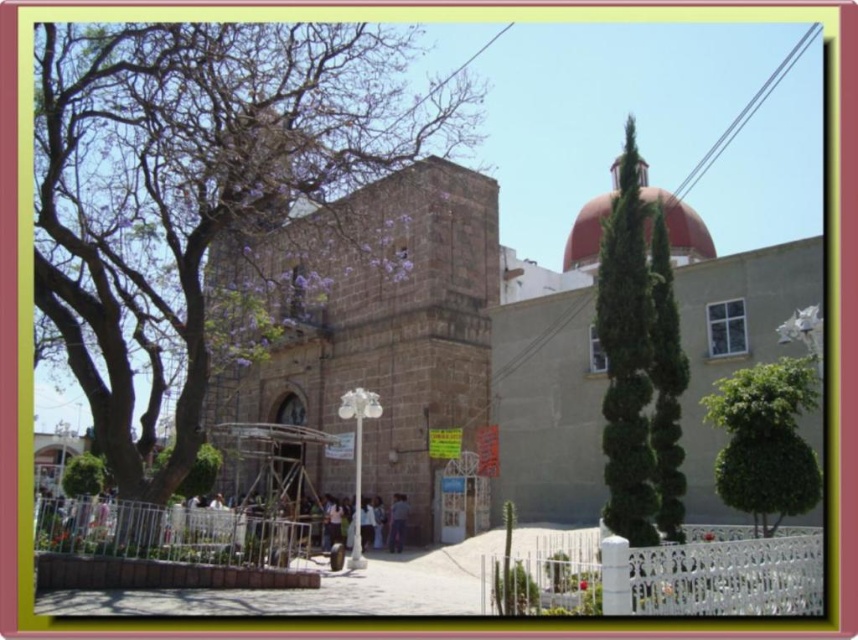
Which is more to the left, green textured cone at center or green leafy tree at lower right?

From the viewer's perspective, green leafy tree at lower right appears more on the left side.

Who is taller, green textured cone at center or green leafy tree at lower right?

green textured cone at center is taller.

This screenshot has width=858, height=640. Find the location of `green textured cone at center`. green textured cone at center is located at coordinates (626, 356).

Can you confirm if brown stone church at center is positioned to the left of green textured bush at center?

Yes, brown stone church at center is to the left of green textured bush at center.

Locate an element on the screen. The image size is (858, 640). brown stone church at center is located at coordinates (450, 355).

Is green textured cone at center taller than green textured bush at center?

Yes.

Who is more distant from viewer, (626, 257) or (668, 380)?

The point (668, 380) is behind.

Identify the location of green textured cone at center. (626, 356).